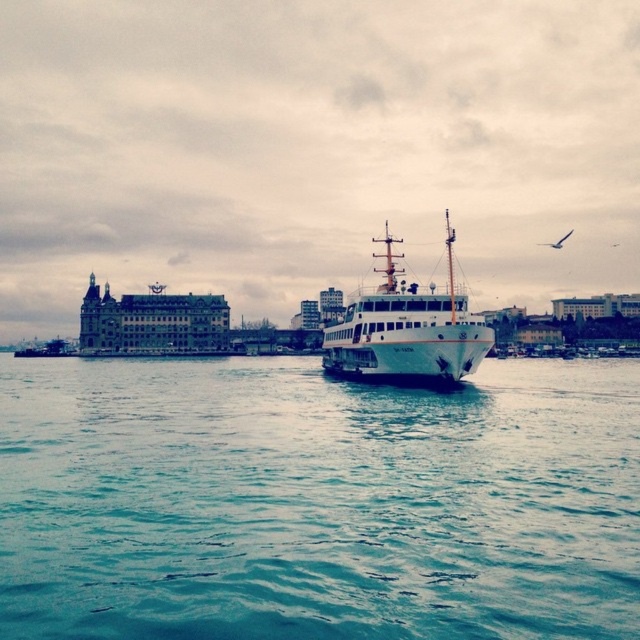
You are standing at the point labeled point (460, 614) and want to walk towards the point labeled point (394, 259). Given that the ferry boat is between these two points, will you have to walk around the ferry boat?

Yes, you will have to walk around the ferry boat because point (460, 614) is closer to the viewer than point (394, 259), meaning the ferry boat is blocking the direct path between them.

You are a passenger on the white matte ship at center and want to see the blue water at center. In which direction should you look from your position on the ship?

The blue water at center is located below the white matte ship at center, so you should look downward to see the blue water at center.